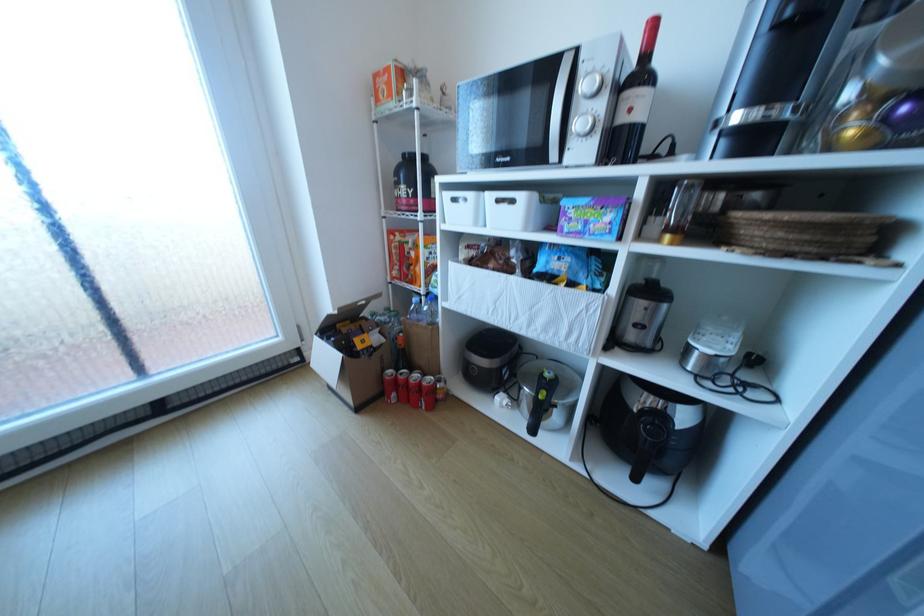
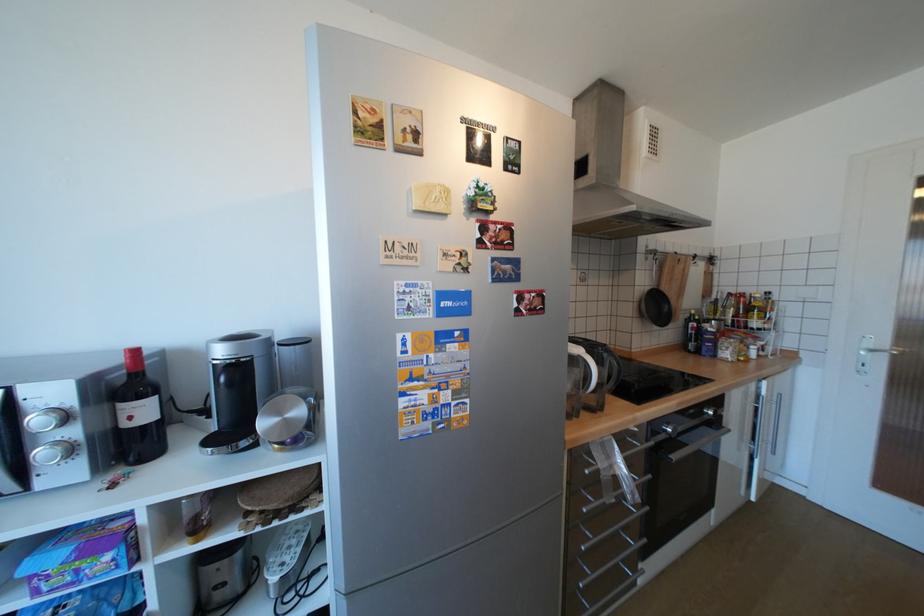
Find the pixel in the second image that matches [592,87] in the first image.

(46, 419)